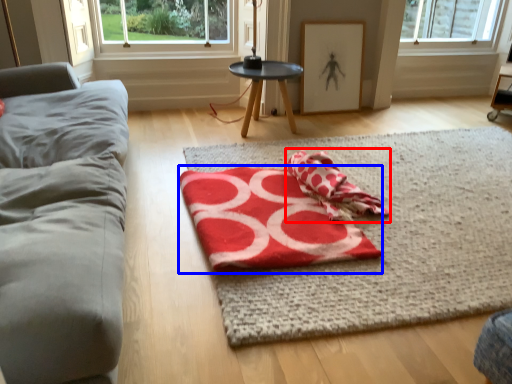
Question: Which of the following is the closest to the observer, beach towel (highlighted by a red box) or beach towel (highlighted by a blue box)?

Choices:
 (A) beach towel
 (B) beach towel

Answer: (B)